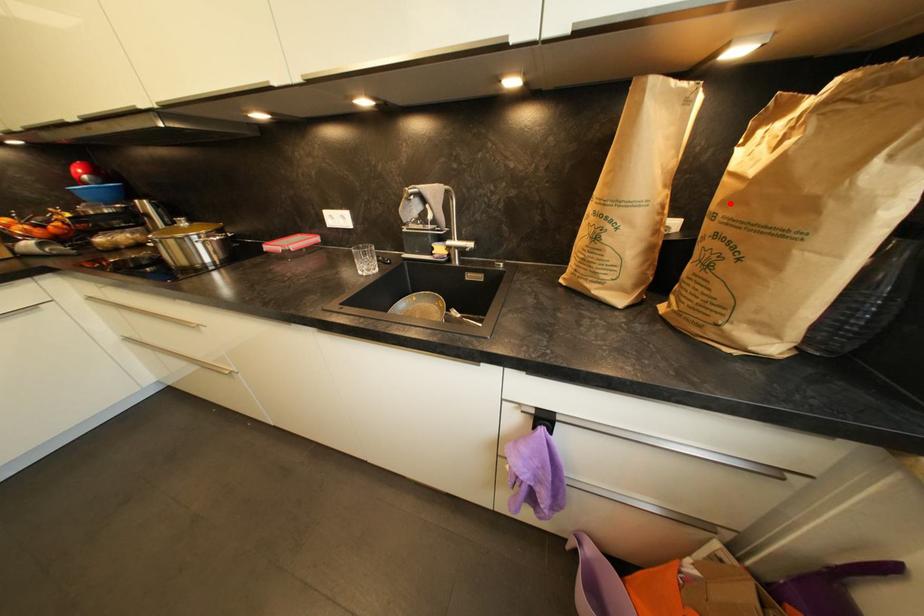
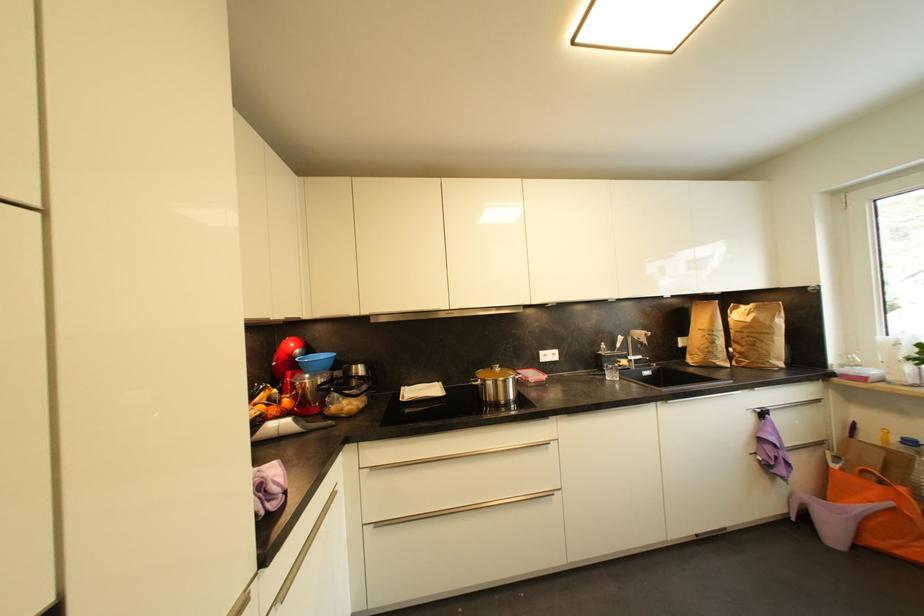
Find the pixel in the second image that matches the highlighted location in the first image.

(748, 330)